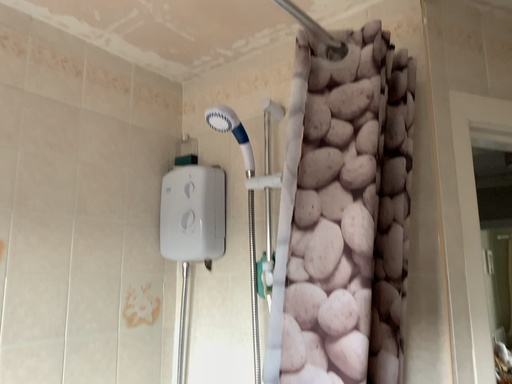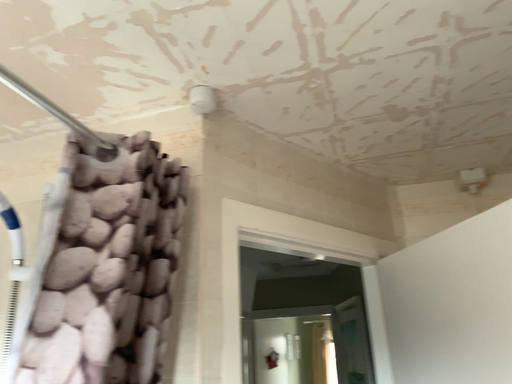
Question: Which way did the camera rotate in the video?

Choices:
 (A) rotated downward
 (B) rotated upward

Answer: (B)